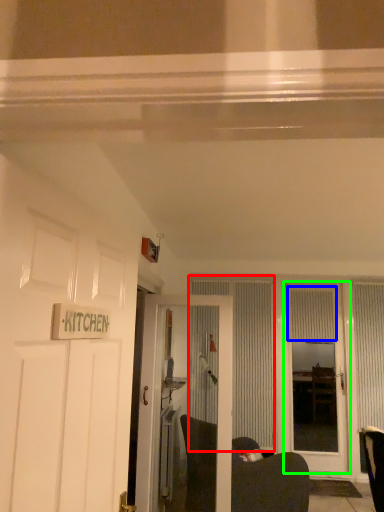
Question: Which object is the closest to the curtain (highlighted by a red box)? Choose among these: curtain (highlighted by a blue box) or door (highlighted by a green box).

Choices:
 (A) curtain
 (B) door

Answer: (B)